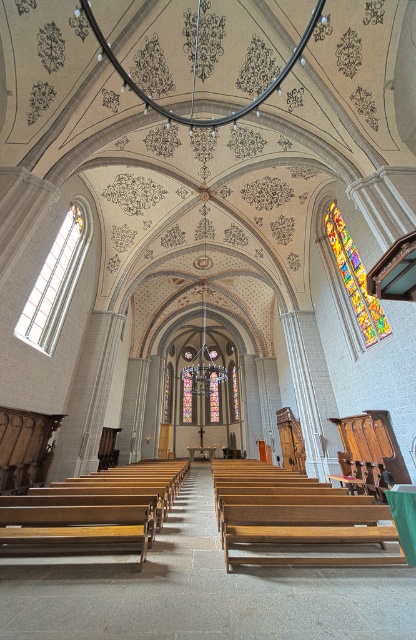
You are a visitor in the church and want to sit in a spot where you can see the multicolored stained glass at upper right. Is the wooden bench at center a good option?

Yes, the wooden bench at center is positioned under the multicolored stained glass at upper right, so sitting there would allow you to see it.

You are a visitor in the church and want to sit on the bench. There are two benches at the center. One is labeled as wooden church bench at center and the other is wooden bench at center. Which bench is shorter?

The wooden church bench at center is shorter than the wooden bench at center.